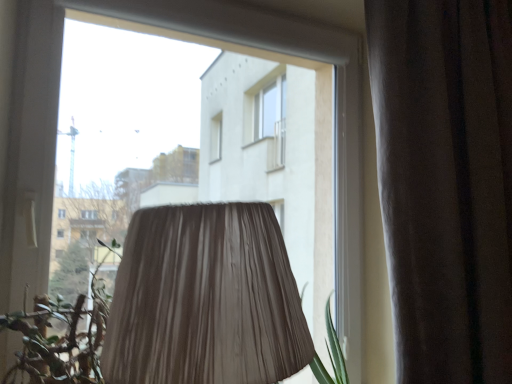
Question: Should I look upward or downward to see brown velvet curtain at right?

Choices:
 (A) up
 (B) down

Answer: (A)

Question: From the image's perspective, does brown velvet curtain at right appear higher than green leafy plant at lower left?

Choices:
 (A) yes
 (B) no

Answer: (A)

Question: Is brown velvet curtain at right looking in the opposite direction of green leafy plant at lower left?

Choices:
 (A) yes
 (B) no

Answer: (B)

Question: Would you say brown velvet curtain at right contains green leafy plant at lower left?

Choices:
 (A) yes
 (B) no

Answer: (B)

Question: Is the surface of brown velvet curtain at right in direct contact with green leafy plant at lower left?

Choices:
 (A) no
 (B) yes

Answer: (A)

Question: Does brown velvet curtain at right have a larger size compared to green leafy plant at lower left?

Choices:
 (A) no
 (B) yes

Answer: (B)

Question: Can you confirm if brown velvet curtain at right is taller than green leafy plant at lower left?

Choices:
 (A) no
 (B) yes

Answer: (B)

Question: Is green leafy plant at lower left in front of brown velvet curtain at right?

Choices:
 (A) no
 (B) yes

Answer: (B)

Question: Can you confirm if green leafy plant at lower left is positioned to the right of brown velvet curtain at right?

Choices:
 (A) no
 (B) yes

Answer: (A)

Question: Does green leafy plant at lower left have a lesser height compared to brown velvet curtain at right?

Choices:
 (A) yes
 (B) no

Answer: (A)

Question: Could you tell me if green leafy plant at lower left is turned towards brown velvet curtain at right?

Choices:
 (A) yes
 (B) no

Answer: (B)

Question: Is green leafy plant at lower left with brown velvet curtain at right?

Choices:
 (A) no
 (B) yes

Answer: (A)

Question: Is green leafy plant at lower left positioned far away from brown velvet curtain at right?

Choices:
 (A) no
 (B) yes

Answer: (A)

Question: Considering the positions of green leafy plant at lower left and brown velvet curtain at right in the image, is green leafy plant at lower left wider or thinner than brown velvet curtain at right?

Choices:
 (A) thin
 (B) wide

Answer: (B)